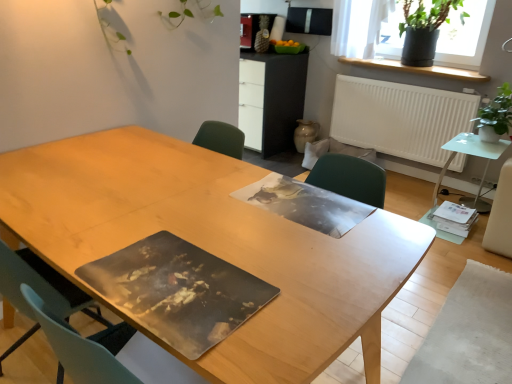
You are a GUI agent. You are given a task and a screenshot of the screen. Output one action in this format:
    pyautogui.click(x=<x>, y=<y>)
    Task: Click on the vacant area on top of white matte radiator at upper right (from a real-world perspective)
    
    Given the screenshot: What is the action you would take?
    pyautogui.click(x=402, y=79)